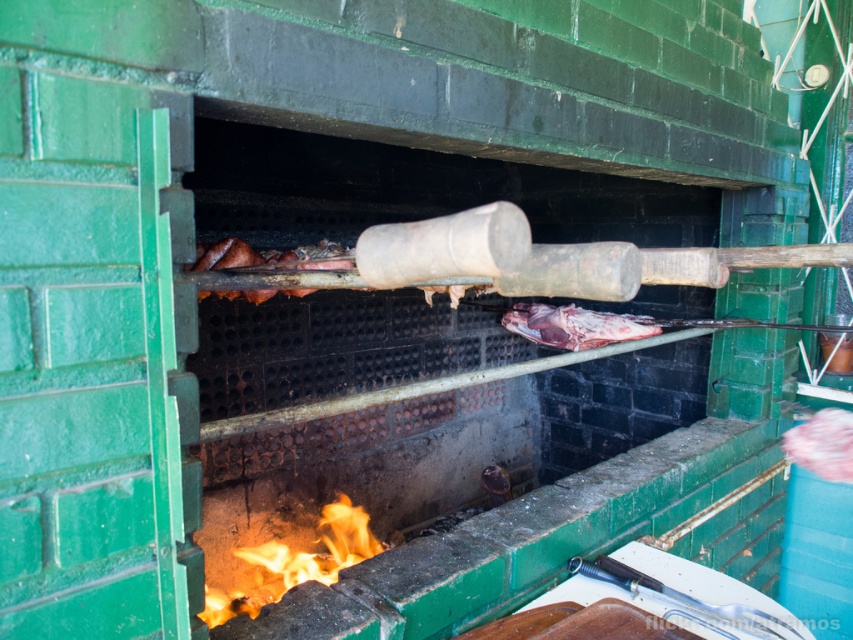
You are a chef preparing to adjust the cooking temperature in the oven. You have the charcoal grill at center and the flametransparentfire at lower center. Which object is higher up in the oven?

The charcoal grill at center is taller than the flametransparentfire at lower center, so the charcoal grill at center is higher up in the oven.

You are a chef preparing a dish in the oven described. You notice the flametransparentfire at lower center and the raw red meat at center. Which object is closer to the heat source?

The flametransparentfire at lower center is the heat source itself, so the raw red meat at center is closer to it compared to the fire, but since the fire is the heat source, the meat is directly above the flames. Therefore, the raw red meat at center is closest to the heat source.

Based on the photo, you are standing in front of the green brick oven and notice two points inside it. The first point is at coordinates point (265, 483) and the second is at point (643, 323). Which point is closer to you?

Point (265, 483) is closer to the viewer than point (643, 323).